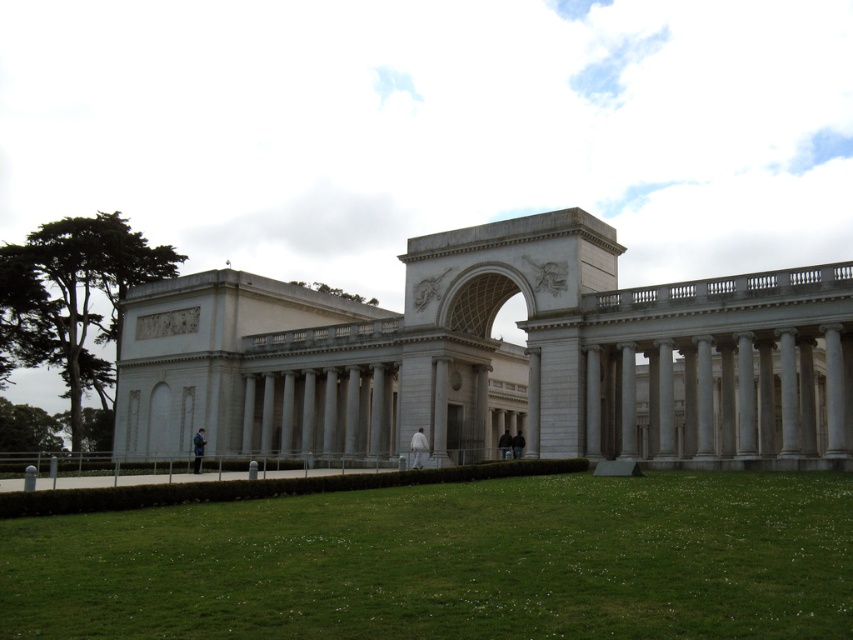
You are standing in front of the grand neoclassical building described in the scene. There is a point marked at coordinates (494, 356). What object does this point correspond to?

The point at coordinates (494, 356) corresponds to the white stone palace at center.

You are standing on the green grass at lower center and want to walk towards the white stone palace at center. Which direction should you move?

You should move to the right because the white stone palace at center is to the left of green grass at lower center, so moving right will bring you closer to it.